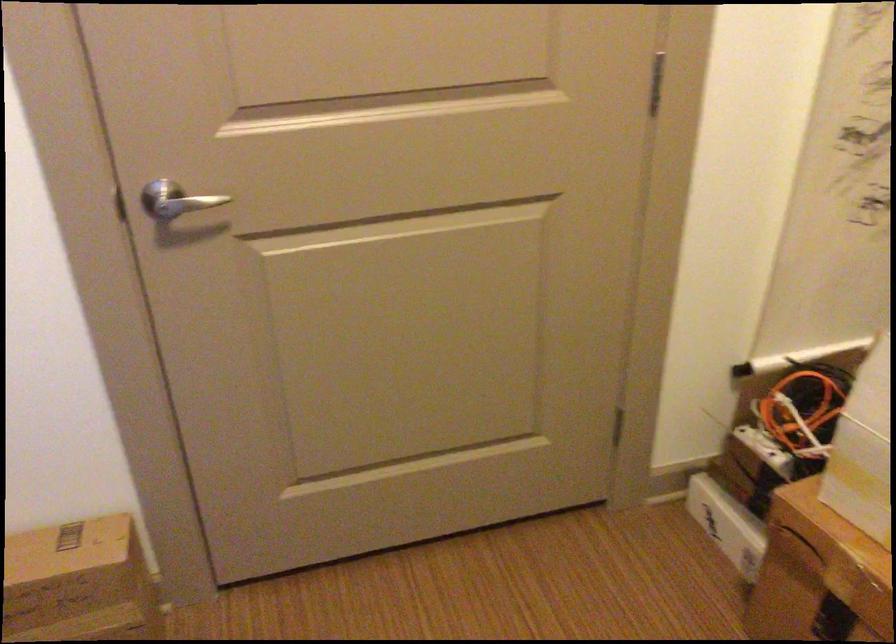
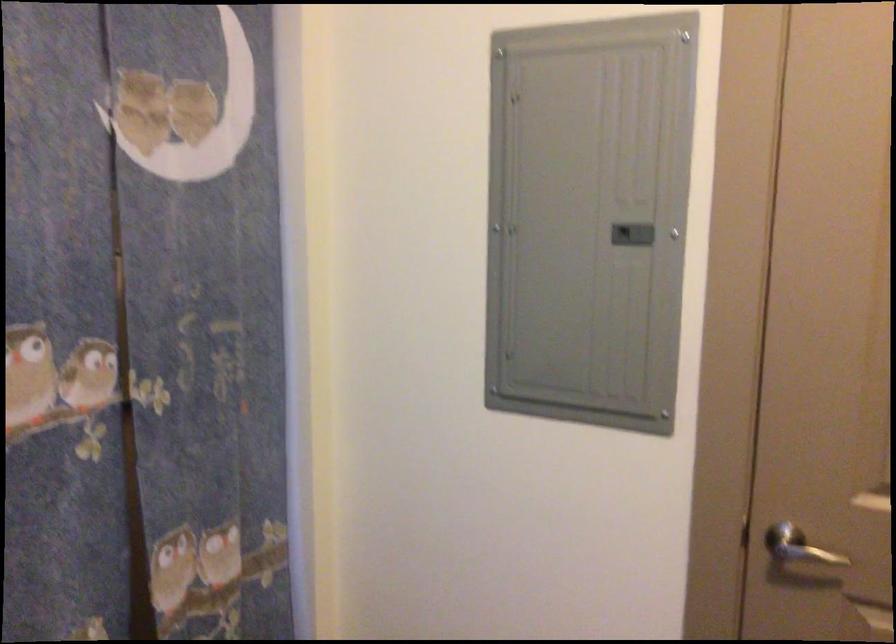
In the second image, find the point that corresponds to point (178, 203) in the first image.

(806, 554)